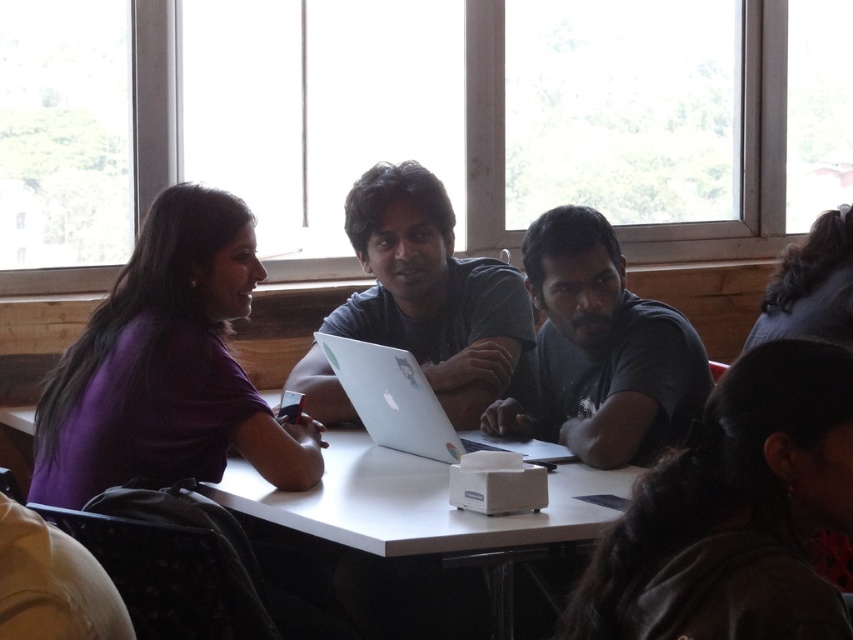
Question: Estimate the real-world distances between objects in this image. Which object is farther from the purple matte shirt at left?

Choices:
 (A) white glossy table at center
 (B) dark gray shirt at lower right
 (C) gray matte shirt at center
 (D) silver metallic laptop at center

Answer: (B)

Question: Can you confirm if dark gray shirt at lower right is positioned to the right of purple matte shirt at left?

Choices:
 (A) yes
 (B) no

Answer: (A)

Question: Can you confirm if dark gray shirt at lower right is positioned to the left of purple matte shirt at left?

Choices:
 (A) no
 (B) yes

Answer: (A)

Question: Estimate the real-world distances between objects in this image. Which object is farther from the purple matte shirt at left?

Choices:
 (A) silver metallic laptop at center
 (B) satin gray laptop at center
 (C) gray matte shirt at center

Answer: (C)

Question: Which point is closer to the camera taking this photo?

Choices:
 (A) [x=614, y=291]
 (B) [x=851, y=499]
 (C) [x=402, y=548]

Answer: (B)

Question: Can you confirm if dark gray shirt at lower right is bigger than silver metallic laptop at center?

Choices:
 (A) no
 (B) yes

Answer: (A)